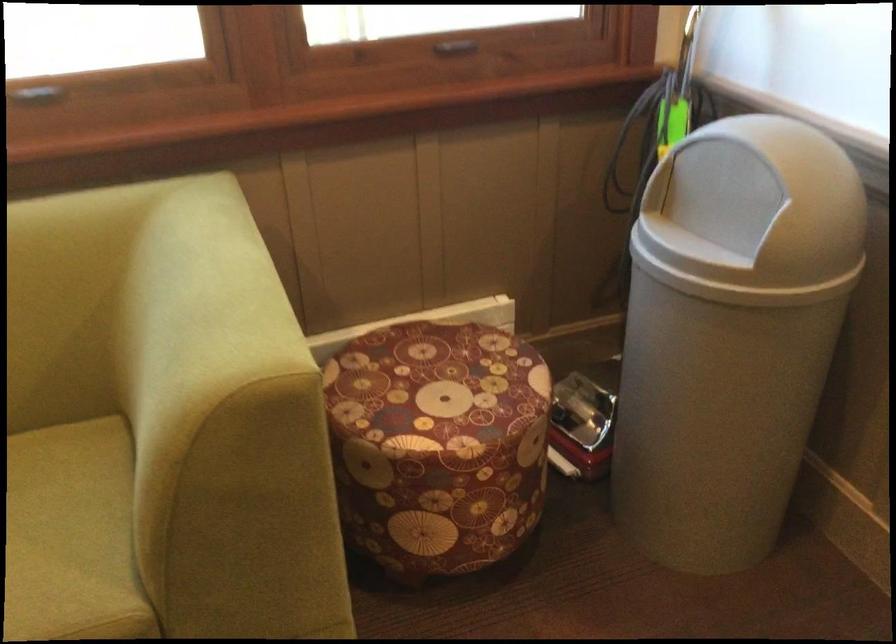
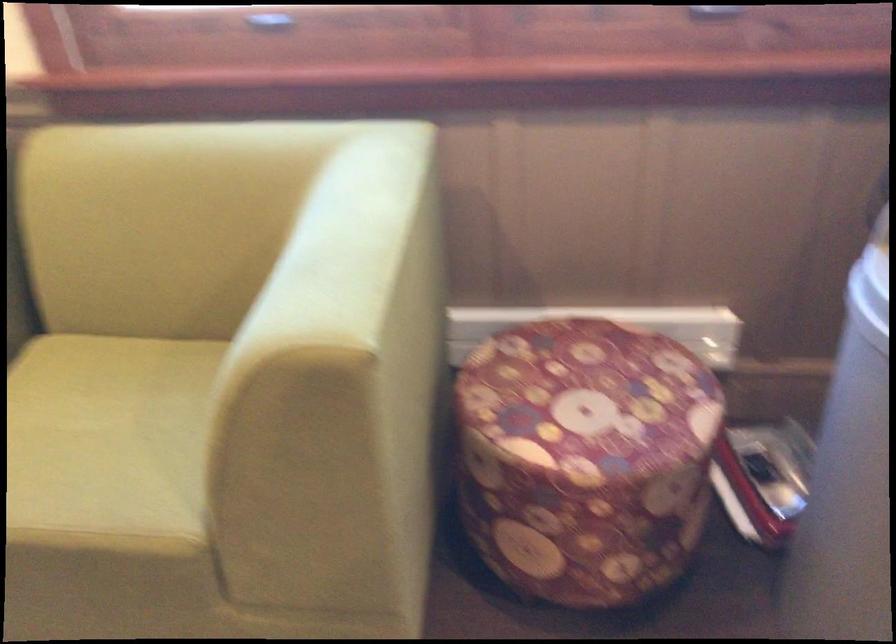
Question: Based on the continuous images, in which direction is the camera rotating? Reply with the corresponding letter.

Choices:
 (A) Left
 (B) Right
 (C) Up
 (D) Down

Answer: (A)